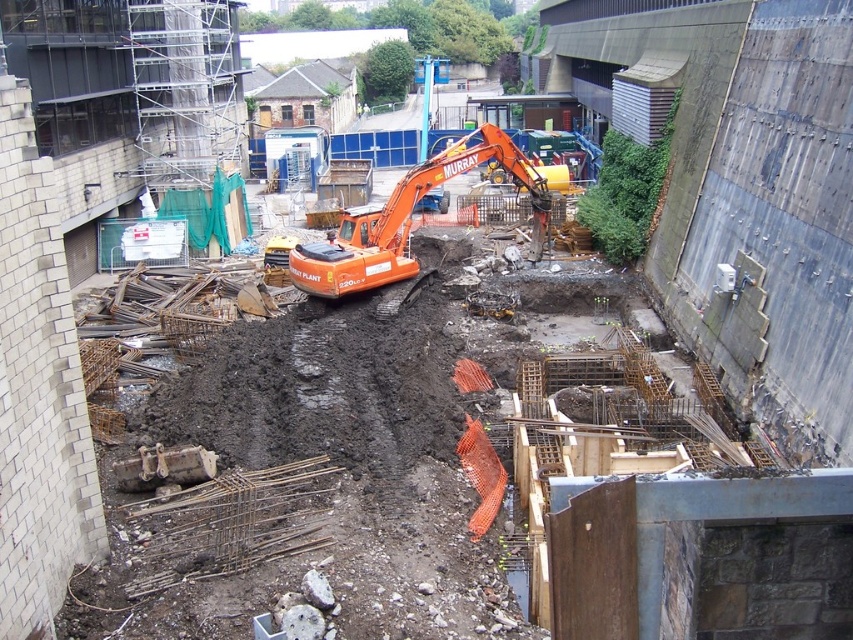
Can you confirm if orange rubber excavator at center is thinner than orange hard hat at center?

Incorrect, orange rubber excavator at center's width is not less than orange hard hat at center's.

The height and width of the screenshot is (640, 853). I want to click on orange rubber excavator at center, so click(x=409, y=220).

Identify the location of orange rubber excavator at center. This screenshot has width=853, height=640. click(x=409, y=220).